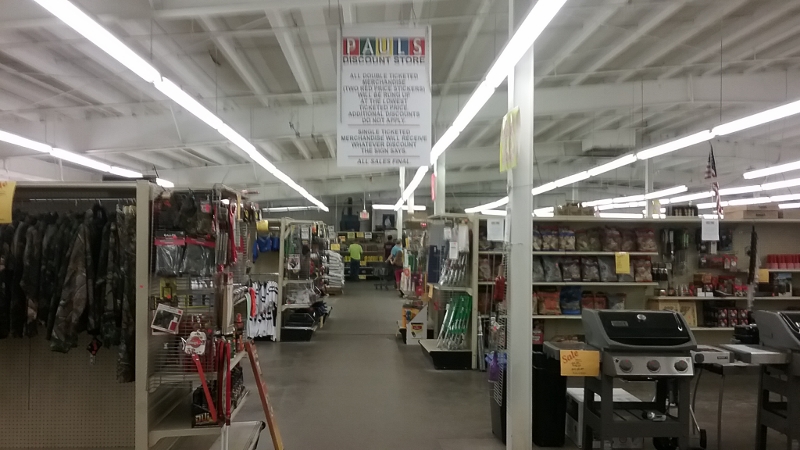
You are a GUI agent. You are given a task and a screenshot of the screen. Output one action in this format:
    pyautogui.click(x=<x>, y=<y>)
    Task: Click on the shelves
    This screenshot has height=450, width=800.
    Given the screenshot: What is the action you would take?
    pyautogui.click(x=577, y=251), pyautogui.click(x=482, y=284), pyautogui.click(x=434, y=350), pyautogui.click(x=444, y=289)